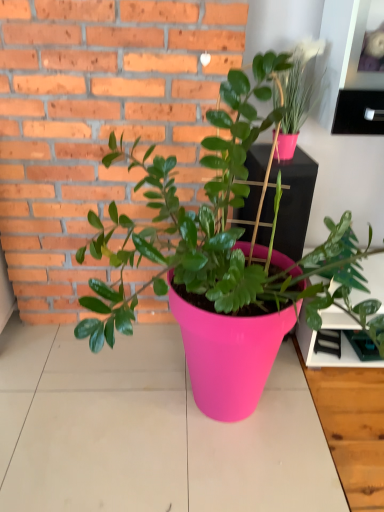
Question: Is matte pink pot at upper right, which is counted as the first houseplant, starting from the right, located within pink plastic pot at center, the 1th houseplant viewed from the left?

Choices:
 (A) yes
 (B) no

Answer: (A)

Question: Is pink plastic pot at center, the 1th houseplant viewed from the left, at the right side of matte pink pot at upper right, positioned as the 2th houseplant in left-to-right order?

Choices:
 (A) yes
 (B) no

Answer: (B)

Question: Is pink plastic pot at center, acting as the 2th houseplant starting from the right, positioned in front of matte pink pot at upper right, positioned as the 2th houseplant in left-to-right order?

Choices:
 (A) no
 (B) yes

Answer: (B)

Question: Is pink plastic pot at center, acting as the 2th houseplant starting from the right, bigger than matte pink pot at upper right, positioned as the 2th houseplant in left-to-right order?

Choices:
 (A) no
 (B) yes

Answer: (B)

Question: From the image's perspective, is pink plastic pot at center, the 1th houseplant viewed from the left, above matte pink pot at upper right, which is counted as the first houseplant, starting from the right?

Choices:
 (A) yes
 (B) no

Answer: (B)

Question: In the image, is pink plastic pot at center, acting as the 2th houseplant starting from the right, positioned in front of or behind pink plastic table top at center?

Choices:
 (A) behind
 (B) front

Answer: (B)

Question: Based on their sizes in the image, would you say pink plastic pot at center, acting as the 2th houseplant starting from the right, is bigger or smaller than pink plastic table top at center?

Choices:
 (A) small
 (B) big

Answer: (B)

Question: Is pink plastic pot at center, acting as the 2th houseplant starting from the right, taller or shorter than pink plastic table top at center?

Choices:
 (A) short
 (B) tall

Answer: (B)

Question: From a real-world perspective, relative to pink plastic table top at center, is pink plastic pot at center, acting as the 2th houseplant starting from the right, vertically above or below?

Choices:
 (A) above
 (B) below

Answer: (A)

Question: Is pink plastic table top at center to the left or to the right of pink plastic shelf at upper right in the image?

Choices:
 (A) left
 (B) right

Answer: (A)

Question: Considering the positions of point (52, 360) and point (331, 128), is point (52, 360) closer or farther from the camera than point (331, 128)?

Choices:
 (A) closer
 (B) farther

Answer: (B)

Question: Is pink plastic table top at center wider or thinner than pink plastic shelf at upper right?

Choices:
 (A) thin
 (B) wide

Answer: (B)

Question: From a real-world perspective, is pink plastic table top at center positioned above or below pink plastic shelf at upper right?

Choices:
 (A) below
 (B) above

Answer: (A)

Question: From the image's perspective, is matte pink pot at upper right, which is counted as the first houseplant, starting from the right, located above or below pink plastic shelf at upper right?

Choices:
 (A) below
 (B) above

Answer: (B)

Question: Considering the relative positions of matte pink pot at upper right, positioned as the 2th houseplant in left-to-right order, and pink plastic shelf at upper right in the image provided, is matte pink pot at upper right, positioned as the 2th houseplant in left-to-right order, to the left or to the right of pink plastic shelf at upper right?

Choices:
 (A) left
 (B) right

Answer: (A)